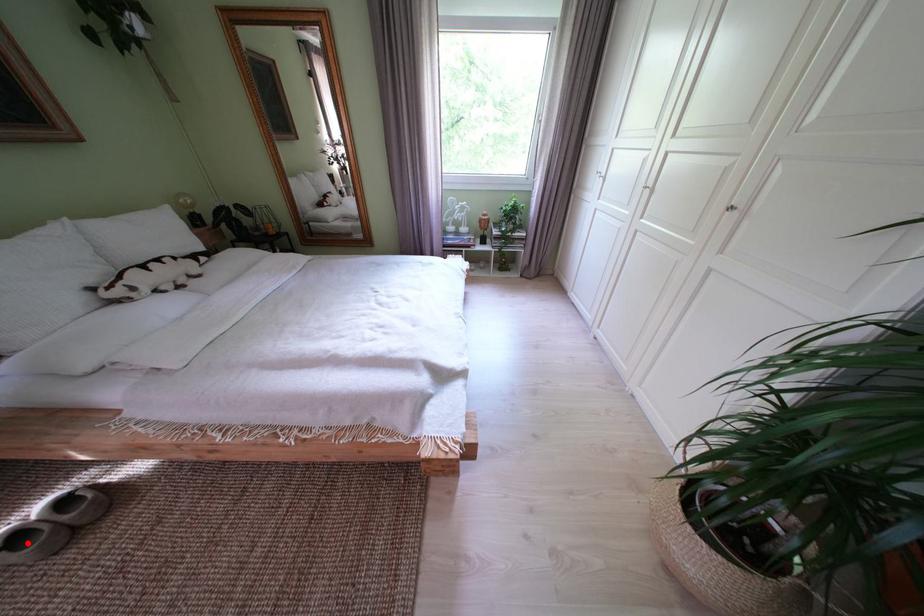
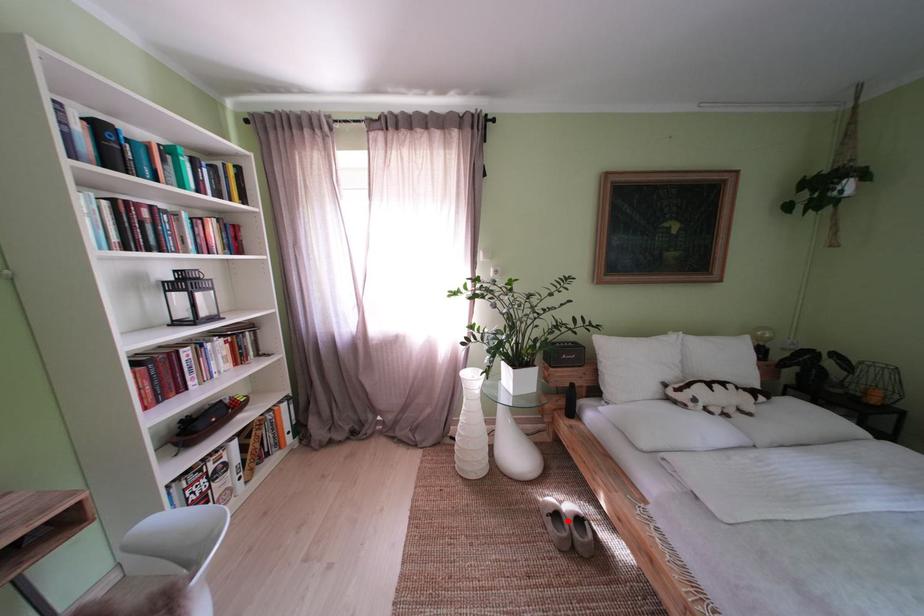
I am providing you with two images of the same scene from different viewpoints. A red point is marked on the first image and another point is marked on the second image. Does the point marked in image1 correspond to the same location as the one in image2?

Yes